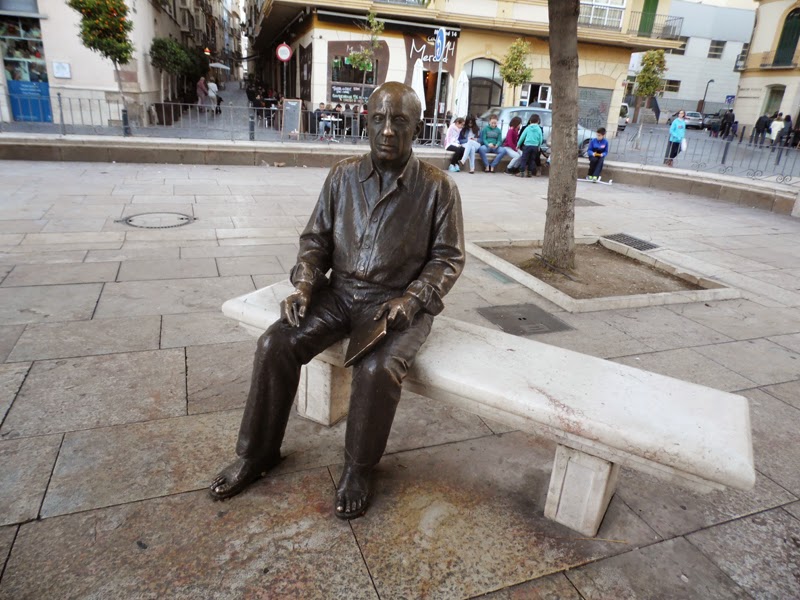
Find the location of a particular element. Image resolution: width=800 pixels, height=600 pixels. chalkboard is located at coordinates (290, 118).